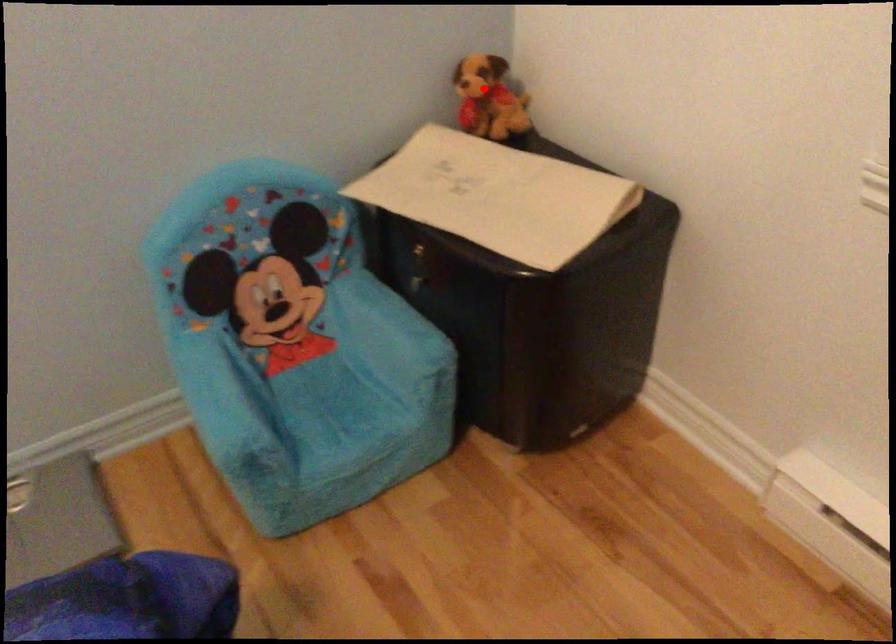
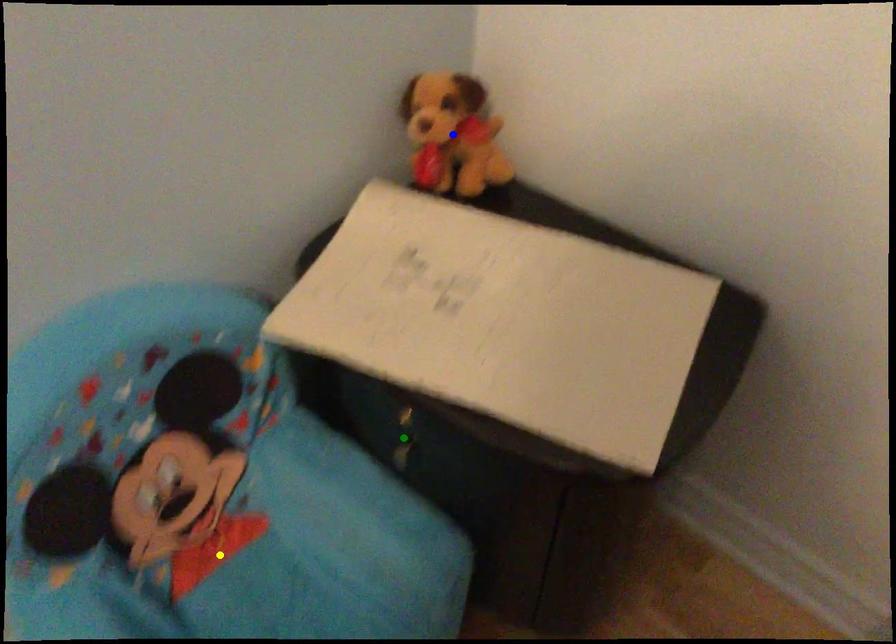
Question: I am providing you with two images of the same scene from different viewpoints. A red point is marked on the first image. You are given multiple points on the second image. In image 2, which mark is for the same physical point as the one in image 1?

Choices:
 (A) blue point
 (B) green point
 (C) yellow point

Answer: (A)